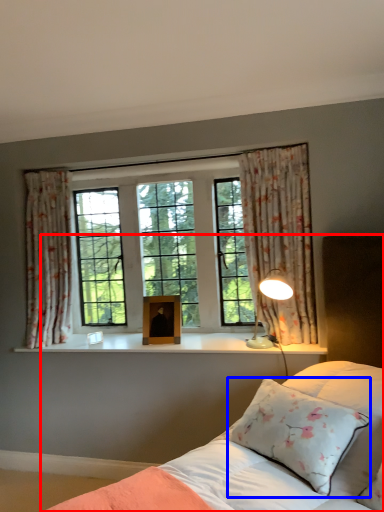
Question: Which point is closer to the camera, bed (highlighted by a red box) or pillow (highlighted by a blue box)?

Choices:
 (A) bed
 (B) pillow

Answer: (A)